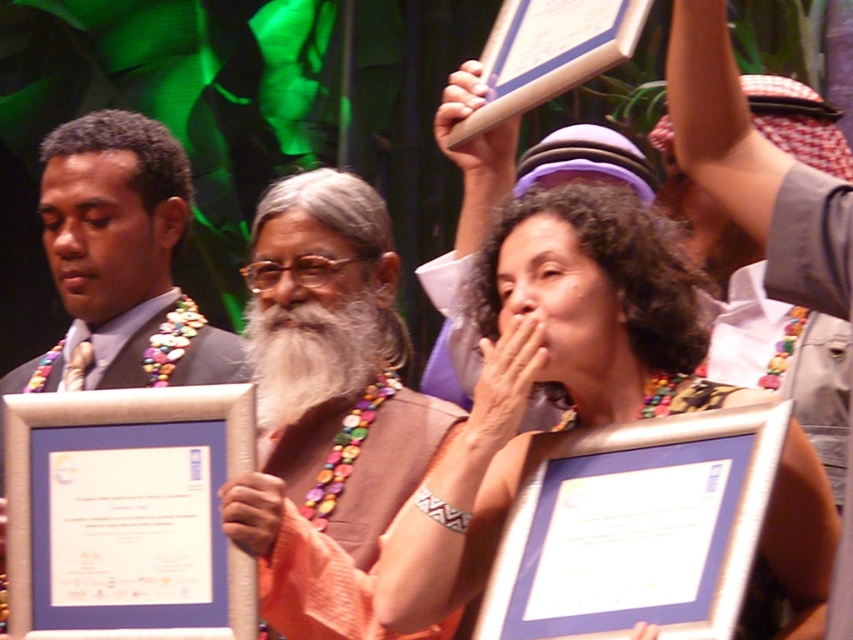
Looking at this image, what is the position of the point labeled as point (x=128, y=513) in the image?

The point labeled as point (x=128, y=513) is on white paper at center.

You are an event photographer at the award ceremony. You need to capture a photo where both the multicolored beaded necklace at center and the white paper at center are visible. Based on their positions, which object should you ensure is closer to the left side of the frame to include both?

The white paper at center should be positioned closer to the left side of the frame because the multicolored beaded necklace at center is to the right of it, ensuring both are visible.